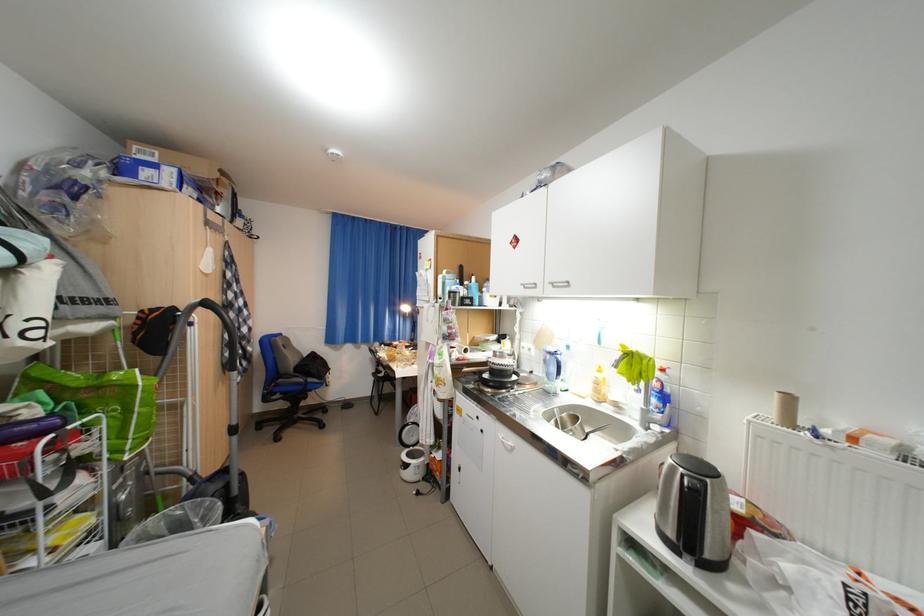
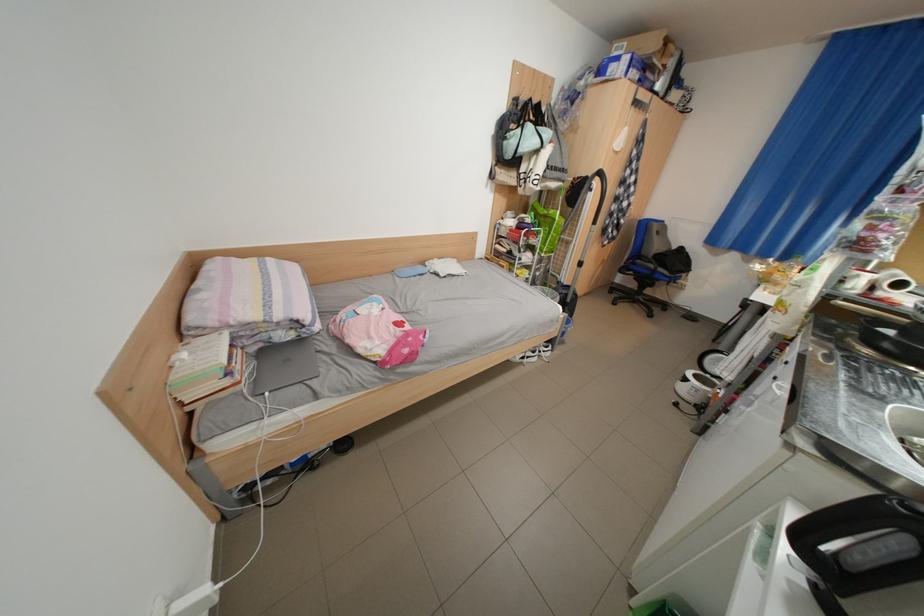
The point at (493, 432) is marked in the first image. Where is the corresponding point in the second image?

(786, 379)